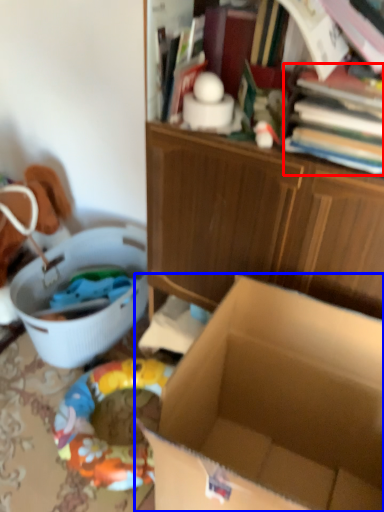
Question: Which object is further to the camera taking this photo, book (highlighted by a red box) or box (highlighted by a blue box)?

Choices:
 (A) book
 (B) box

Answer: (A)